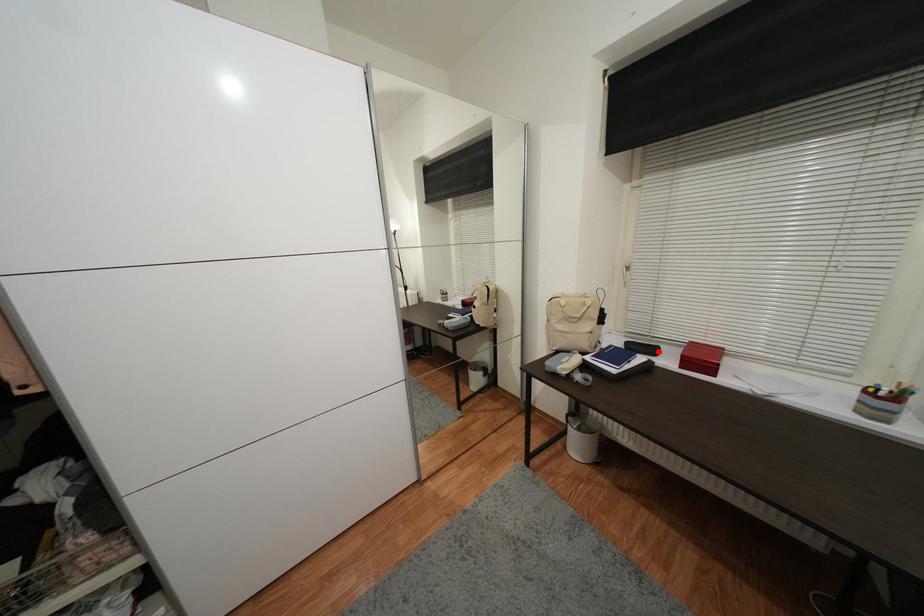
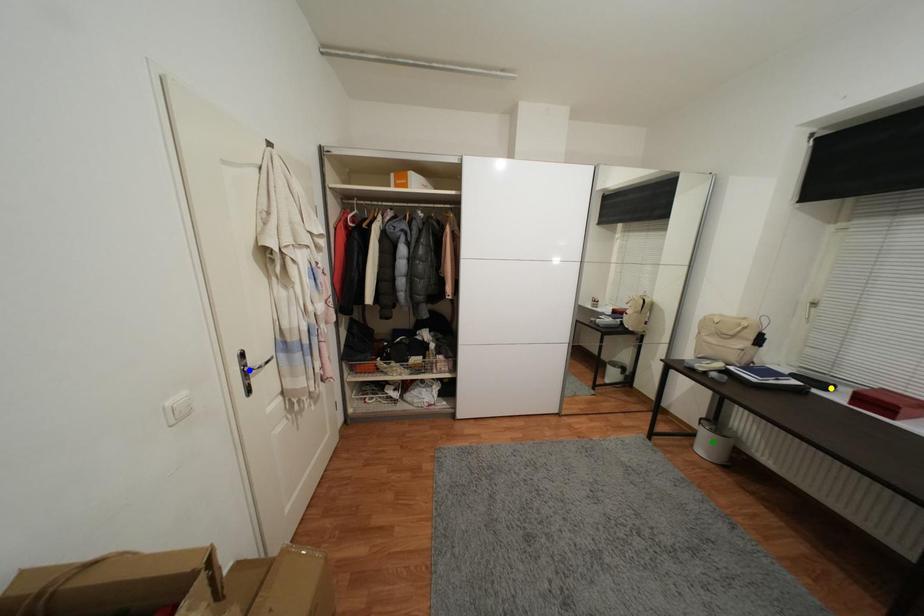
Question: I am providing you with two images of the same scene from different viewpoints. A red point is marked on the first image. You are given multiple points on the second image. Which spot in image 2 lines up with the point in image 1?

Choices:
 (A) green point
 (B) yellow point
 (C) blue point

Answer: (B)